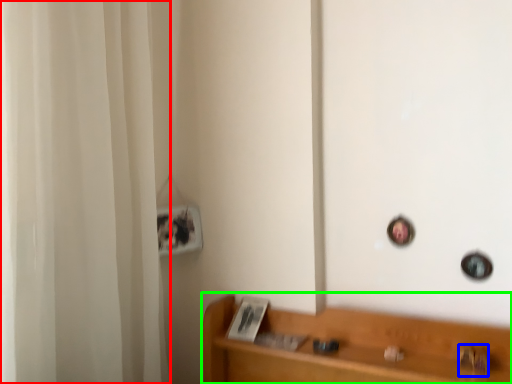
Question: Estimate the real-world distances between objects in this image. Which object is farther from shower curtain (highlighted by a red box), door handle (highlighted by a blue box) or furniture (highlighted by a green box)?

Choices:
 (A) door handle
 (B) furniture

Answer: (A)